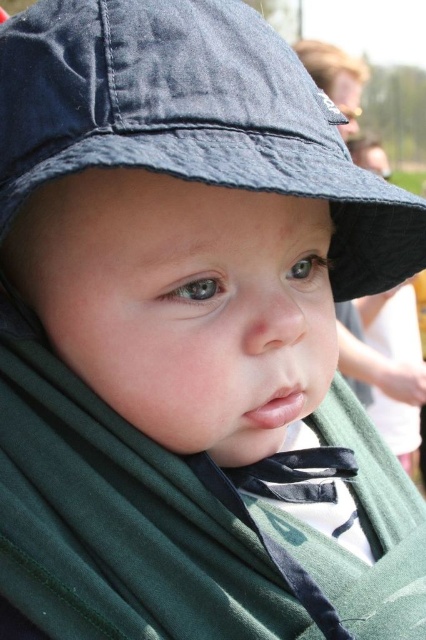
Can you confirm if green soft fabric shawl at center is smaller than dark blue fabric hat at upper center?

Yes, green soft fabric shawl at center is smaller than dark blue fabric hat at upper center.

Find the location of a particular element. The width and height of the screenshot is (426, 640). green soft fabric shawl at center is located at coordinates (187, 528).

Identify the location of green soft fabric shawl at center. This screenshot has width=426, height=640. (187, 528).